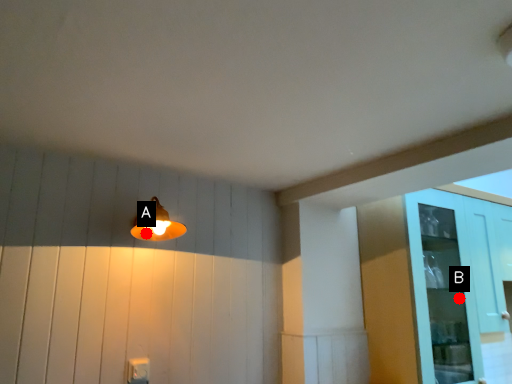
Question: Two points are circled on the image, labeled by A and B beside each circle. Among these points, which one is farthest from the camera?

Choices:
 (A) A is further
 (B) B is further

Answer: (B)